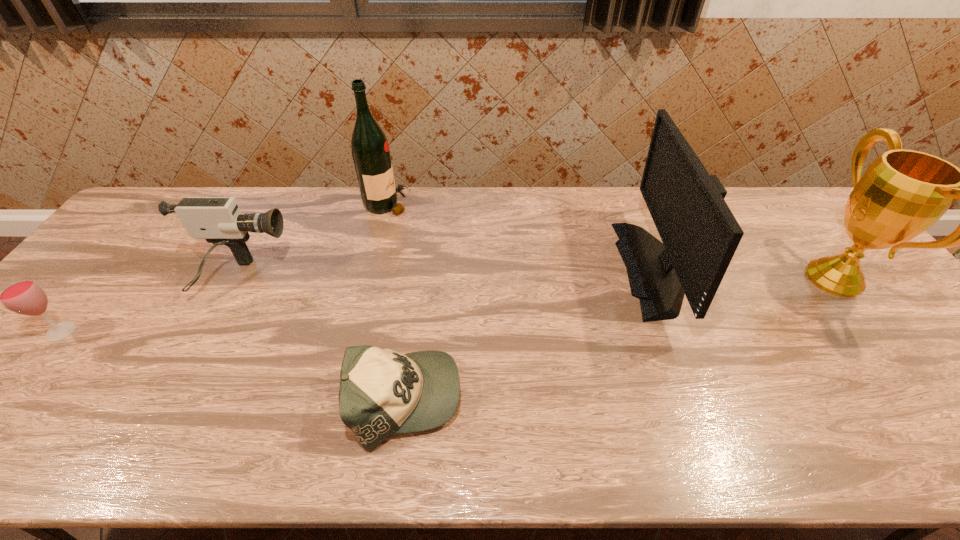
The width and height of the screenshot is (960, 540). What are the coordinates of `wine bottle` in the screenshot? It's located at (370, 150).

Locate an element on the screen. award is located at coordinates (x=903, y=193).

Find the location of `the second object from right to left`. the second object from right to left is located at coordinates (700, 235).

The height and width of the screenshot is (540, 960). I want to click on the fifth object from right to left, so click(219, 220).

The image size is (960, 540). I want to click on the third shortest object, so pos(219,220).

I want to click on wineglass, so click(23, 295).

Identify the location of the second shortest object. (23, 295).

Where is `the nearest object`? the nearest object is located at coordinates (382, 392).

Find the location of a particular element. This screenshot has height=540, width=960. the shortest object is located at coordinates (382, 392).

The width and height of the screenshot is (960, 540). Find the location of `free space located 0.100m on the front of the wine bottle`. free space located 0.100m on the front of the wine bottle is located at coordinates (379, 238).